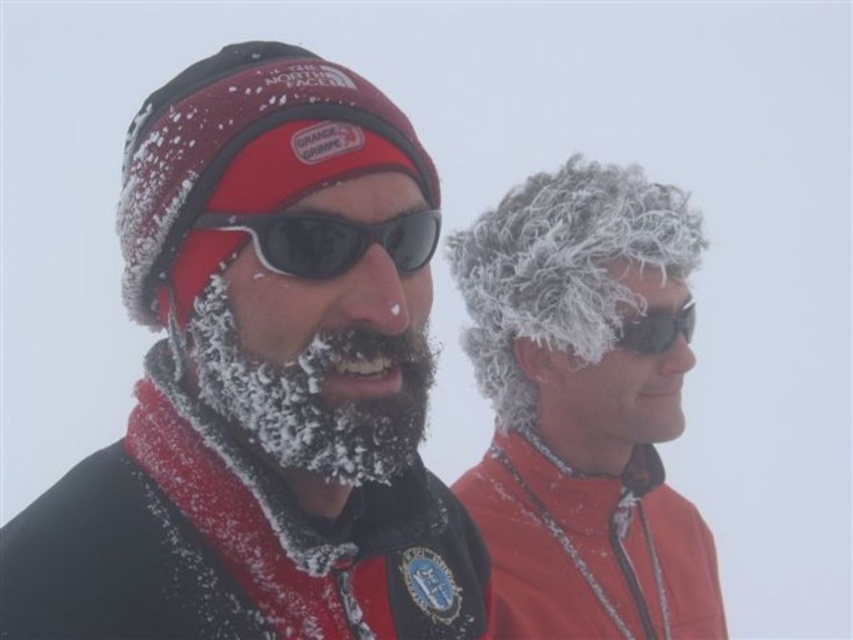
Question: Can you confirm if black plastic sunglasses at center is smaller than sunglasses at right?

Choices:
 (A) yes
 (B) no

Answer: (B)

Question: Can you confirm if curly hair at right is smaller than white frosty beard at center?

Choices:
 (A) yes
 (B) no

Answer: (B)

Question: Which object is closer to the camera taking this photo?

Choices:
 (A) white frosty beard at center
 (B) curly hair at right

Answer: (A)

Question: Is white frosty beard at center thinner than sunglasses at right?

Choices:
 (A) yes
 (B) no

Answer: (B)

Question: Among these points, which one is nearest to the camera?

Choices:
 (A) (502, 636)
 (B) (376, 349)

Answer: (B)

Question: Which object is positioned closest to the white frosty beard at center?

Choices:
 (A) curly hair at right
 (B) black plastic sunglasses at center
 (C) sunglasses at right
 (D) matte black jacket at center

Answer: (D)